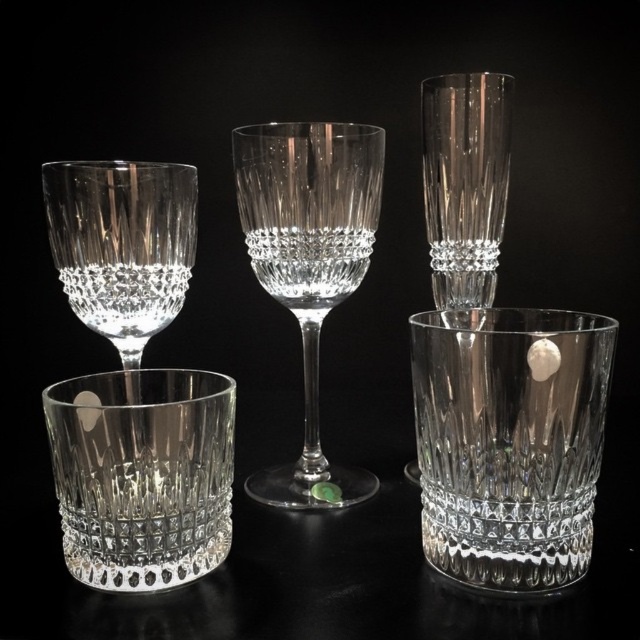
Does clear crystal cup at center have a larger size compared to crystal clear wine glass at center?

No, clear crystal cup at center is not bigger than crystal clear wine glass at center.

Does clear crystal cup at center appear on the left side of crystal clear wine glass at center?

Yes, clear crystal cup at center is to the left of crystal clear wine glass at center.

Who is more distant from viewer, (112, 419) or (262, 204)?

Positioned behind is point (262, 204).

You are a GUI agent. You are given a task and a screenshot of the screen. Output one action in this format:
    pyautogui.click(x=<x>, y=<y>)
    Task: Click on the clear crystal cup at center
    The height and width of the screenshot is (640, 640).
    Given the screenshot: What is the action you would take?
    pyautogui.click(x=141, y=474)

Does clear crystal cup at center appear on the left side of clear crystal wine glass at center?

In fact, clear crystal cup at center is to the right of clear crystal wine glass at center.

Is clear crystal cup at center positioned at the back of clear crystal wine glass at center?

No, clear crystal cup at center is in front of clear crystal wine glass at center.

Which is behind, point (164, 481) or point (147, 163)?

The point (147, 163) is behind.

Find the location of a particular element. clear crystal cup at center is located at coordinates 141,474.

Is point (314, 170) closer to camera compared to point (64, 275)?

Yes, point (314, 170) is closer to viewer.

Which is more to the right, crystal clear wine glass at center or clear crystal wine glass at center?

crystal clear wine glass at center

Who is more forward, [305,204] or [168,224]?

Point [168,224] is more forward.

Locate an element on the screen. crystal clear wine glass at center is located at coordinates (308, 262).